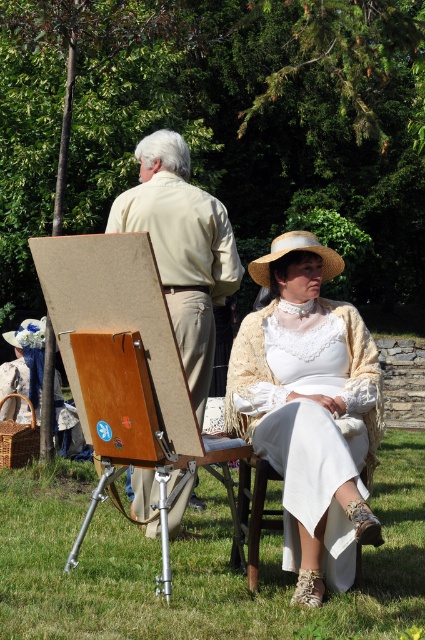
Question: Which of the following is the farthest from the observer?

Choices:
 (A) (328, 276)
 (B) (139, 476)

Answer: (B)

Question: Does green grass at lower center have a greater width compared to light beige shirt at center?

Choices:
 (A) no
 (B) yes

Answer: (B)

Question: Among these objects, which one is farthest from the camera?

Choices:
 (A) light beige shirt at center
 (B) matte straw hat at center

Answer: (A)

Question: Which point is farther from the camera taking this photo?

Choices:
 (A) (331, 444)
 (B) (251, 268)
 (C) (124, 221)

Answer: (C)

Question: Can you confirm if wooden easel at center is thinner than light beige shirt at center?

Choices:
 (A) yes
 (B) no

Answer: (B)

Question: Is green grass at lower center above strawmaterial/texturehat at center?

Choices:
 (A) yes
 (B) no

Answer: (B)